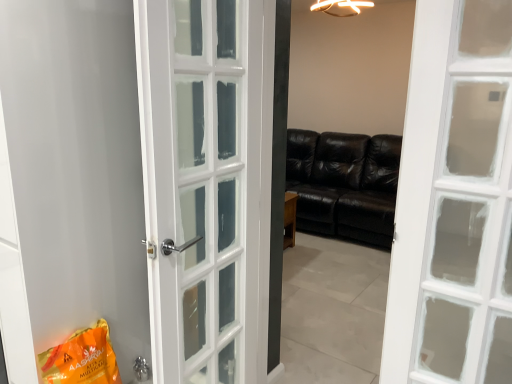
Question: Is polished silver door handle at lower center wider or thinner than white glossy door at left?

Choices:
 (A) thin
 (B) wide

Answer: (A)

Question: From their relative heights in the image, would you say polished silver door handle at lower center is taller or shorter than white glossy door at left?

Choices:
 (A) tall
 (B) short

Answer: (B)

Question: Considering the real-world distances, which object is farthest from the black leather couch at center?

Choices:
 (A) orange matte shopping bag at lower left
 (B) polished silver door handle at lower center
 (C) white glossy door at left

Answer: (A)

Question: Based on their relative distances, which object is nearer to the polished silver door handle at lower center?

Choices:
 (A) black leather couch at center
 (B) orange matte shopping bag at lower left
 (C) white glossy door at left

Answer: (B)